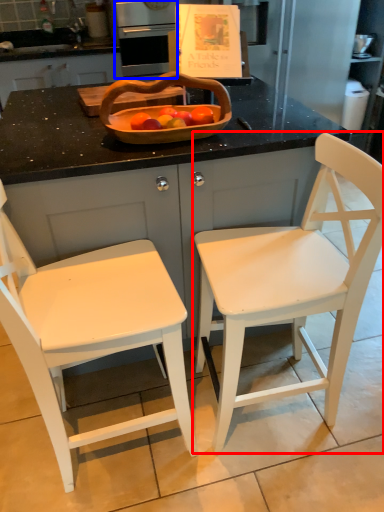
Question: Which object appears closest to the camera in this image, chair (highlighted by a red box) or kitchen appliance (highlighted by a blue box)?

Choices:
 (A) chair
 (B) kitchen appliance

Answer: (A)